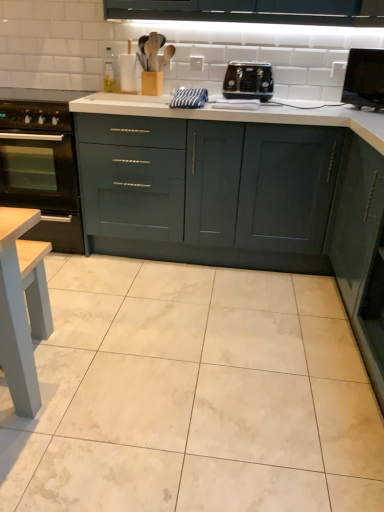
You are a GUI agent. You are given a task and a screenshot of the screen. Output one action in this format:
    pyautogui.click(x=<x>, y=<y>)
    Task: Click on the vacant area situated to the left side of matte dark green cabinet at right, which is counted as the 2th cabinetry, starting from the back
    
    Given the screenshot: What is the action you would take?
    click(x=306, y=385)